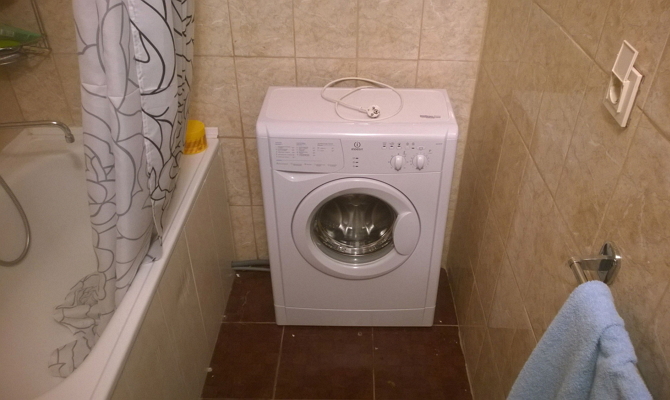
Where is `shower curtain`? This screenshot has height=400, width=670. shower curtain is located at coordinates (118, 201).